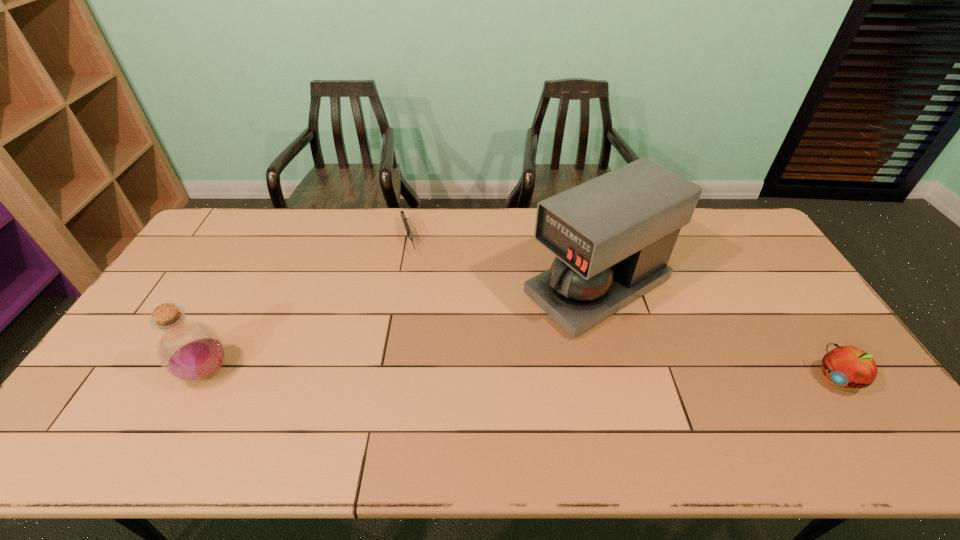
You are a GUI agent. You are given a task and a screenshot of the screen. Output one action in this format:
    pyautogui.click(x=<x>, y=<y>)
    Task: Click on the bottle
    The image size is (960, 540).
    Given the screenshot: What is the action you would take?
    pyautogui.click(x=191, y=351)

Identify the location of the leftmost object. (191, 351).

The height and width of the screenshot is (540, 960). In order to click on apple in this screenshot , I will do `click(845, 366)`.

Identify the location of the second shortest object. (845, 366).

This screenshot has height=540, width=960. I want to click on the third object from right to left, so click(x=404, y=219).

The image size is (960, 540). Identify the location of gun. (404, 219).

Find the location of a particular element. The height and width of the screenshot is (540, 960). coffee maker is located at coordinates (612, 236).

You are a GUI agent. You are given a task and a screenshot of the screen. Output one action in this format:
    pyautogui.click(x=<x>, y=<y>)
    Task: Click on the second object from right to left
    The width and height of the screenshot is (960, 540).
    Given the screenshot: What is the action you would take?
    pyautogui.click(x=612, y=236)

At what (x,y) coordinates should I click in order to perform the action: click on vacant region located on the right of the leftmost object. Please return your answer as a coordinate pair (x, y). The image size is (960, 540). Looking at the image, I should click on (318, 372).

This screenshot has width=960, height=540. What are the coordinates of `vacant position located on the back of the second shortest object` in the screenshot? It's located at (801, 325).